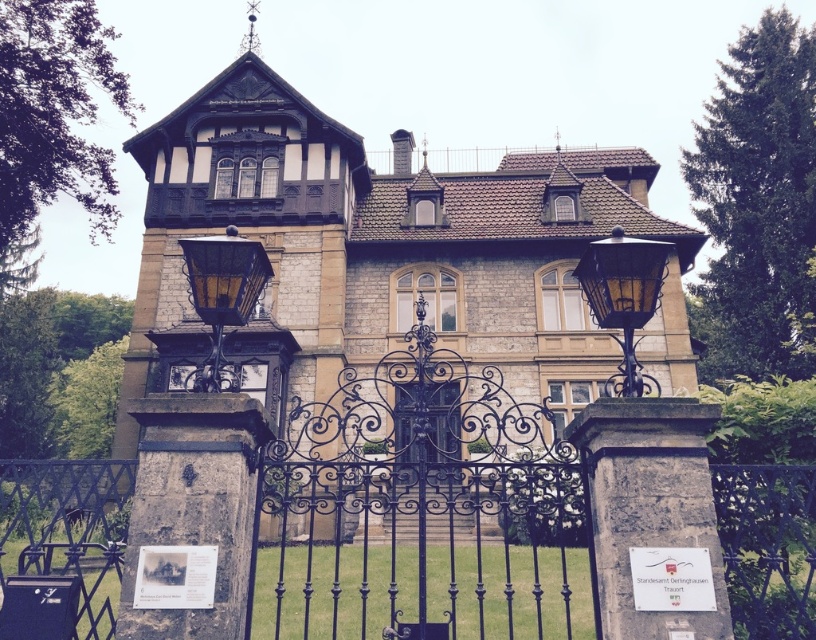
Can you confirm if black wrought iron lamp at center is shorter than polished dark wood door at center?

Yes, black wrought iron lamp at center is shorter than polished dark wood door at center.

Between black wrought iron lamp at center and polished dark wood door at center, which one is positioned lower?

Positioned lower is polished dark wood door at center.

Does point (613, 244) come farther from viewer compared to point (415, 456)?

No, (613, 244) is in front of (415, 456).

At what (x,y) coordinates should I click in order to perform the action: click on black wrought iron lamp at center. Please return your answer as a coordinate pair (x, y). The image size is (816, 640). Looking at the image, I should click on (624, 296).

Is stone mansion at center taller than polished dark wood door at center?

Indeed, stone mansion at center has a greater height compared to polished dark wood door at center.

Where is `stone mansion at center`? The height and width of the screenshot is (640, 816). stone mansion at center is located at coordinates (397, 244).

Image resolution: width=816 pixels, height=640 pixels. In order to click on stone mansion at center in this screenshot , I will do click(397, 244).

Is the position of stone mansion at center less distant than that of black wrought iron gate at center?

No, it is behind black wrought iron gate at center.

Who is positioned more to the right, stone mansion at center or black wrought iron gate at center?

stone mansion at center is more to the right.

Which is behind, point (180, 195) or point (309, 602)?

The point (180, 195) is more distant.

You are a GUI agent. You are given a task and a screenshot of the screen. Output one action in this format:
    pyautogui.click(x=<x>, y=<y>)
    Task: Click on the stone mansion at center
    The image size is (816, 640).
    Given the screenshot: What is the action you would take?
    [x=397, y=244]